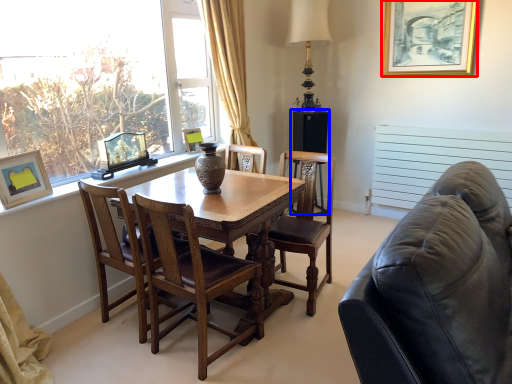
Question: Which of the following is the farthest to the observer, picture frame (highlighted by a red box) or speaker (highlighted by a blue box)?

Choices:
 (A) picture frame
 (B) speaker

Answer: (B)